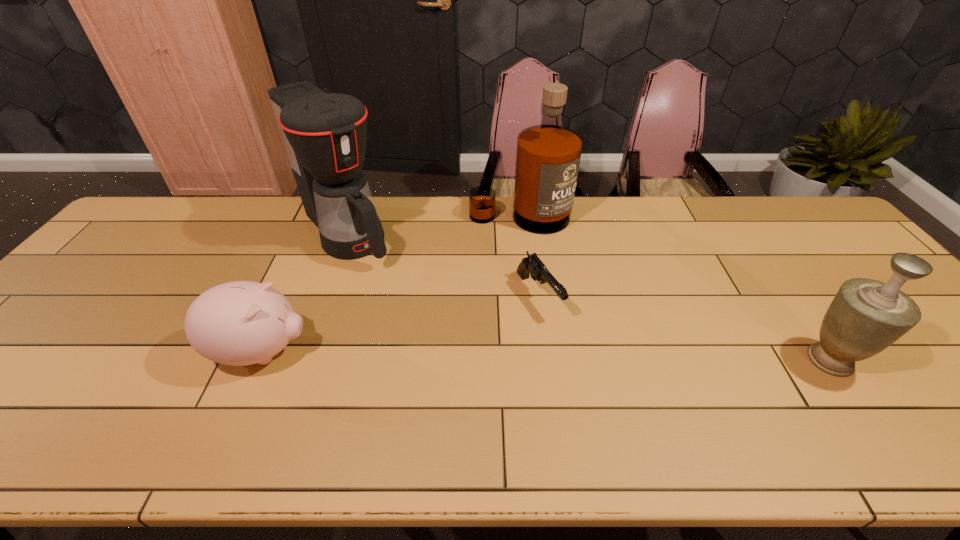
The image size is (960, 540). I want to click on free area in between the gun and the piggy bank, so click(x=400, y=323).

Locate an element on the screen. The height and width of the screenshot is (540, 960). free spot between the third shortest object and the coffee maker is located at coordinates (588, 298).

Locate an element on the screen. This screenshot has height=540, width=960. free point between the second shortest object and the coffee maker is located at coordinates (304, 293).

I want to click on free space between the liquor and the third shortest object, so coord(675,289).

This screenshot has height=540, width=960. Identify the location of object that is the second nearest to the fourth tallest object. (532, 265).

Where is `object that is the fourth closest to the gun`? The width and height of the screenshot is (960, 540). object that is the fourth closest to the gun is located at coordinates (866, 316).

Locate an element on the screen. The width and height of the screenshot is (960, 540). blank area in the image that satisfies the following two spatial constraints: 1. on the front side of the shortest object; 2. on the right side of the liquor is located at coordinates (528, 296).